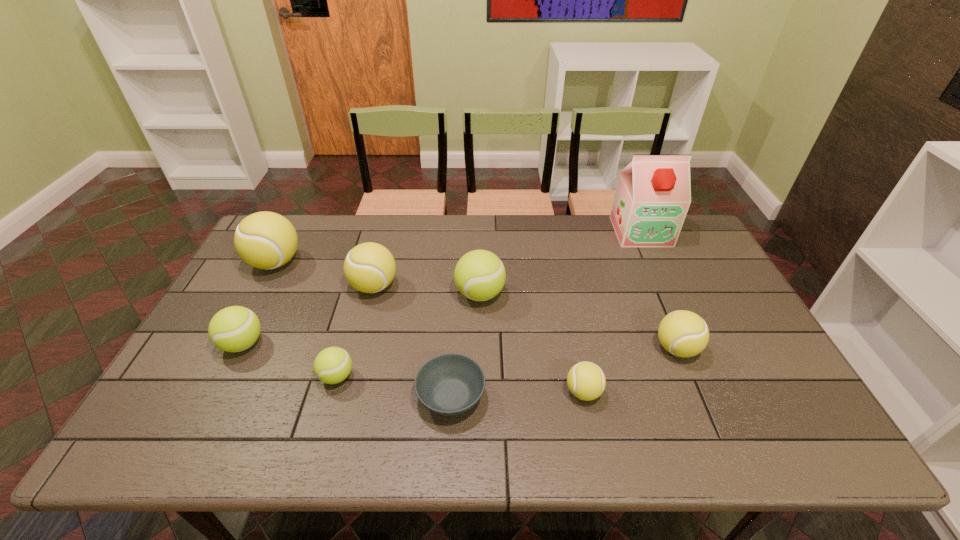
Identify the location of blank region between the second biggest yellow tennis ball and the second green tennis ball from right to left. This screenshot has height=540, width=960. (355, 332).

Locate an element on the screen. free space that is in between the tallest object and the rightmost tennis ball is located at coordinates [x=659, y=290].

This screenshot has height=540, width=960. I want to click on free space between the tallest object and the leftmost green tennis ball, so click(442, 288).

Identify the location of empty space that is in between the tallest tennis ball and the tallest object. (458, 247).

Identify the location of object that is the nearest to the second tennis ball from right to left. This screenshot has width=960, height=540. (683, 333).

The height and width of the screenshot is (540, 960). Find the location of `object that is the third closest to the leftmost green tennis ball`. object that is the third closest to the leftmost green tennis ball is located at coordinates (369, 267).

Locate an element on the screen. The height and width of the screenshot is (540, 960). the sixth closest tennis ball to the leftmost green tennis ball is located at coordinates (683, 333).

This screenshot has width=960, height=540. What are the coordinates of `tennis ball that is the sixth closest one to the second biggest green tennis ball` in the screenshot? It's located at (683, 333).

Identify which yellow tennis ball is located as the fourth nearest to the smallest green tennis ball. Please provide its 2D coordinates. Your answer should be formatted as a tuple, i.e. [(x, y)], where the tuple contains the x and y coordinates of a point satisfying the conditions above.

[(683, 333)]

Select which yellow tennis ball is the closest to the second green tennis ball from left to right. Please provide its 2D coordinates. Your answer should be formatted as a tuple, i.e. [(x, y)], where the tuple contains the x and y coordinates of a point satisfying the conditions above.

[(369, 267)]